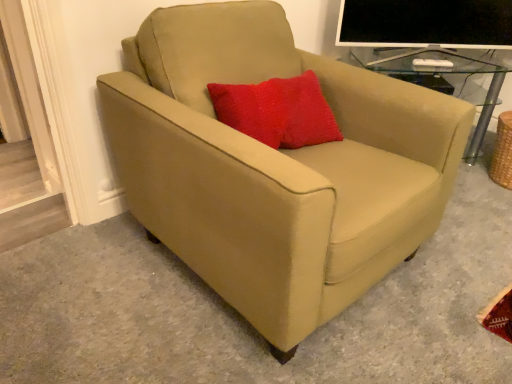
Question: From a real-world perspective, is matte black monitor at upper right physically below suede beige armchair at center?

Choices:
 (A) no
 (B) yes

Answer: (A)

Question: Is matte black monitor at upper right positioned before suede beige armchair at center?

Choices:
 (A) no
 (B) yes

Answer: (A)

Question: Considering the relative sizes of matte black monitor at upper right and suede beige armchair at center in the image provided, is matte black monitor at upper right wider than suede beige armchair at center?

Choices:
 (A) yes
 (B) no

Answer: (B)

Question: Is matte black monitor at upper right shorter than suede beige armchair at center?

Choices:
 (A) no
 (B) yes

Answer: (B)

Question: Could you tell me if matte black monitor at upper right is facing suede beige armchair at center?

Choices:
 (A) yes
 (B) no

Answer: (B)

Question: From the image's perspective, would you say matte black monitor at upper right is shown under suede beige armchair at center?

Choices:
 (A) no
 (B) yes

Answer: (A)

Question: Is suede beige armchair at center not close to matte black monitor at upper right?

Choices:
 (A) yes
 (B) no

Answer: (B)

Question: Does suede beige armchair at center appear on the right side of matte black monitor at upper right?

Choices:
 (A) yes
 (B) no

Answer: (B)

Question: Can you confirm if suede beige armchair at center is bigger than matte black monitor at upper right?

Choices:
 (A) yes
 (B) no

Answer: (A)

Question: Does suede beige armchair at center come in front of matte black monitor at upper right?

Choices:
 (A) yes
 (B) no

Answer: (A)

Question: From the image's perspective, is suede beige armchair at center above matte black monitor at upper right?

Choices:
 (A) no
 (B) yes

Answer: (A)

Question: Is suede beige armchair at center thinner than matte black monitor at upper right?

Choices:
 (A) yes
 (B) no

Answer: (B)

Question: Is point (148, 117) closer or farther from the camera than point (388, 1)?

Choices:
 (A) closer
 (B) farther

Answer: (A)